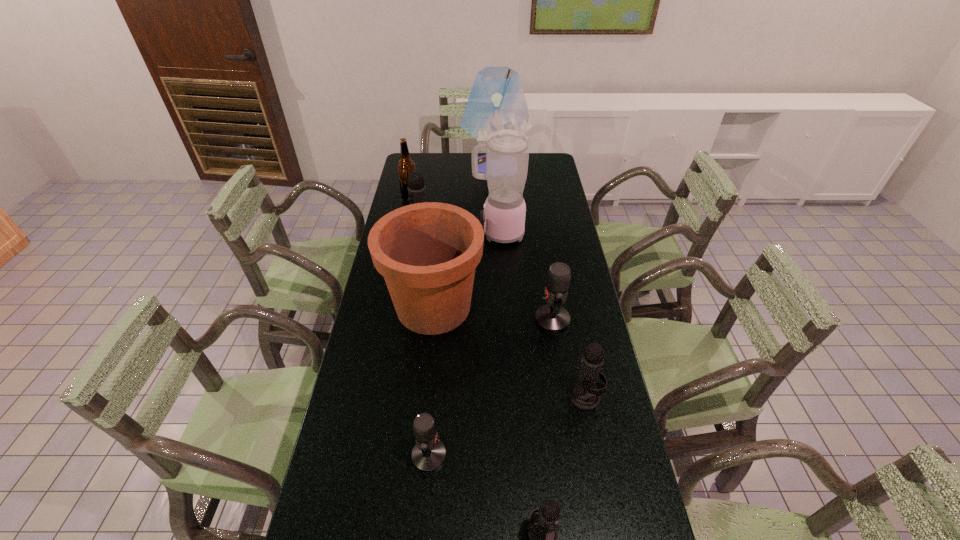
The image size is (960, 540). Identify the location of free space in the image that satisfies the following two spatial constraints: 1. on the label of the beer bottle; 2. on the back side of the second biggest black microphone. (369, 396).

This screenshot has height=540, width=960. What are the coordinates of `free space that satisfies the following two spatial constraints: 1. on the label of the eighth nearest object; 2. on the right side of the second farthest black microphone` in the screenshot? It's located at (369, 396).